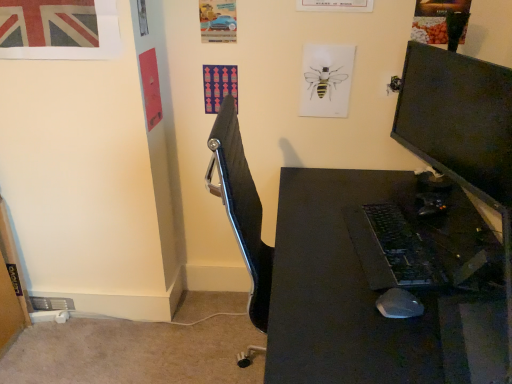
What are the coordinates of `black plastic mouse at lower right` in the screenshot? It's located at (399, 304).

The image size is (512, 384). What do you see at coordinates (458, 119) in the screenshot?
I see `black glossy monitor at right` at bounding box center [458, 119].

Where is `black plastic keyboard at center-right`? black plastic keyboard at center-right is located at coordinates (404, 248).

Locate an element on the screen. The height and width of the screenshot is (384, 512). black plastic mouse at lower right is located at coordinates (399, 304).

Between point (421, 358) and point (495, 170), which one is positioned in front?

Point (421, 358)

Between black plastic desk at center and black glossy monitor at right, which one appears on the right side from the viewer's perspective?

Positioned to the right is black glossy monitor at right.

Which of these two, black plastic desk at center or black glossy monitor at right, stands shorter?

With less height is black glossy monitor at right.

In order to click on desk in front of the black glossy monitor at right in this screenshot , I will do `click(381, 285)`.

Which is in front, union jack paper at upper left, marked as the second poster page in a right-to-left arrangement, or metallic blue car at upper center, the 2th poster page viewed from the front?

union jack paper at upper left, marked as the second poster page in a right-to-left arrangement, is in front.

Between union jack paper at upper left, which is the 1th poster page in front-to-back order, and metallic blue car at upper center, placed as the 2th poster page when sorted from left to right, which one has more height?

With more height is union jack paper at upper left, which is the 1th poster page in front-to-back order.

From a real-world perspective, who is located lower, union jack paper at upper left, marked as the second poster page in a right-to-left arrangement, or metallic blue car at upper center, the 2th poster page viewed from the front?

In real-world perspective, metallic blue car at upper center, the 2th poster page viewed from the front, is lower.

In terms of width, does union jack paper at upper left, marked as the second poster page in a right-to-left arrangement, look wider or thinner when compared to black plastic keyboard at center-right?

→ Considering their sizes, union jack paper at upper left, marked as the second poster page in a right-to-left arrangement, looks slimmer than black plastic keyboard at center-right.

Considering the sizes of objects union jack paper at upper left, marked as the 1th poster page in a left-to-right arrangement, and black plastic keyboard at center-right in the image provided, who is shorter, union jack paper at upper left, marked as the 1th poster page in a left-to-right arrangement, or black plastic keyboard at center-right?

Standing shorter between the two is black plastic keyboard at center-right.

From a real-world perspective, which object rests below the other?

black plastic keyboard at center-right.

Who is bigger, union jack paper at upper left, marked as the second poster page in a right-to-left arrangement, or black plastic keyboard at center-right?

black plastic keyboard at center-right.

Can you tell me how much black plastic desk at center and black plastic mouse at lower right differ in facing direction?

They differ by 3.03 degrees in their facing directions.

Is black plastic desk at center placed right next to black plastic mouse at lower right?

No, black plastic desk at center is not next to black plastic mouse at lower right.

Is black plastic mouse at lower right surrounded by black plastic desk at center?

Indeed, black plastic mouse at lower right is located within black plastic desk at center.

From a real-world perspective, is black plastic desk at center positioned under black plastic mouse at lower right based on gravity?

Yes, from a real-world perspective, black plastic desk at center is below black plastic mouse at lower right.

The image size is (512, 384). Find the location of `computer keyboard below the metallic blue car at upper center, the 1th poster page positioned from the right (from the image's perspective)`. computer keyboard below the metallic blue car at upper center, the 1th poster page positioned from the right (from the image's perspective) is located at coordinates (404, 248).

Which point is more distant from viewer, (381, 240) or (230, 28)?

Positioned behind is point (230, 28).

From the image's perspective, who appears lower, black plastic keyboard at center-right or metallic blue car at upper center, the first poster page from the back?

black plastic keyboard at center-right appears lower in the image.

Is black plastic keyboard at center-right to the left or to the right of metallic blue car at upper center, placed as the 2th poster page when sorted from left to right, in the image?

Based on their positions, black plastic keyboard at center-right is located to the right of metallic blue car at upper center, placed as the 2th poster page when sorted from left to right.

Looking at the image, does black glossy monitor at right seem bigger or smaller compared to metallic blue car at upper center, the first poster page from the back?

black glossy monitor at right is bigger than metallic blue car at upper center, the first poster page from the back.

Which object is thinner, black glossy monitor at right or metallic blue car at upper center, placed as the 2th poster page when sorted from left to right?

With smaller width is metallic blue car at upper center, placed as the 2th poster page when sorted from left to right.

From a real-world perspective, is black glossy monitor at right positioned under metallic blue car at upper center, the first poster page from the back, based on gravity?

Yes, from a real-world perspective, black glossy monitor at right is below metallic blue car at upper center, the first poster page from the back.

How many degrees apart are the facing directions of black glossy monitor at right and black plastic keyboard at center-right?

The facing directions of black glossy monitor at right and black plastic keyboard at center-right are 14.1 degrees apart.

Would you say black glossy monitor at right contains black plastic keyboard at center-right?

No, black plastic keyboard at center-right is not inside black glossy monitor at right.

Is black glossy monitor at right at the left side of black plastic keyboard at center-right?

Incorrect, black glossy monitor at right is not on the left side of black plastic keyboard at center-right.

Is black glossy monitor at right positioned far away from black plastic keyboard at center-right?

That's not correct — black glossy monitor at right is a little close to black plastic keyboard at center-right.

Locate an element on the screen. computer monitor behind the black plastic desk at center is located at coordinates (458, 119).

Locate an element on the screen. This screenshot has height=384, width=512. poster page in front of the metallic blue car at upper center, the 2th poster page viewed from the front is located at coordinates (59, 29).

Which object lies nearer to the anchor point black plastic keyboard at center-right, black plastic desk at center or black glossy monitor at right?

black plastic desk at center is closer to black plastic keyboard at center-right.

Considering their positions, is black glossy monitor at right positioned closer to metallic blue car at upper center, the 1th poster page positioned from the right, than black plastic keyboard at center-right?

Among the two, black glossy monitor at right is located nearer to metallic blue car at upper center, the 1th poster page positioned from the right.

Considering their positions, is black glossy monitor at right positioned closer to black plastic keyboard at center-right than black plastic mouse at lower right?

Among the two, black plastic mouse at lower right is located nearer to black plastic keyboard at center-right.

Looking at the image, which one is located closer to black plastic desk at center, black plastic keyboard at center-right or metallic blue car at upper center, the 1th poster page positioned from the right?

black plastic keyboard at center-right is closer to black plastic desk at center.

From the image, which object appears to be farther from black plastic mouse at lower right, black plastic keyboard at center-right or black glossy monitor at right?

black glossy monitor at right is positioned further to the anchor black plastic mouse at lower right.

From the image, which object appears to be nearer to union jack paper at upper left, marked as the 1th poster page in a left-to-right arrangement, black glossy monitor at right or black plastic keyboard at center-right?

black glossy monitor at right.

From the image, which object appears to be farther from metallic blue car at upper center, placed as the 2th poster page when sorted from left to right, union jack paper at upper left, marked as the second poster page in a right-to-left arrangement, or black plastic desk at center?

black plastic desk at center lies further to metallic blue car at upper center, placed as the 2th poster page when sorted from left to right, than the other object.

Looking at the image, which one is located further to black glossy monitor at right, black plastic keyboard at center-right or black plastic desk at center?

black plastic desk at center is further to black glossy monitor at right.

Locate an element on the screen. The width and height of the screenshot is (512, 384). computer keyboard between union jack paper at upper left, marked as the 1th poster page in a left-to-right arrangement, and black plastic desk at center is located at coordinates (404, 248).

At what (x,y) coordinates should I click in order to perform the action: click on mouse that lies between black glossy monitor at right and black plastic desk at center from top to bottom. Please return your answer as a coordinate pair (x, y). Looking at the image, I should click on [399, 304].

The height and width of the screenshot is (384, 512). Find the location of `computer keyboard between black glossy monitor at right and black plastic desk at center vertically`. computer keyboard between black glossy monitor at right and black plastic desk at center vertically is located at coordinates (404, 248).

Where is `computer keyboard situated between union jack paper at upper left, marked as the second poster page in a right-to-left arrangement, and black glossy monitor at right from left to right`? Image resolution: width=512 pixels, height=384 pixels. computer keyboard situated between union jack paper at upper left, marked as the second poster page in a right-to-left arrangement, and black glossy monitor at right from left to right is located at coordinates (404, 248).